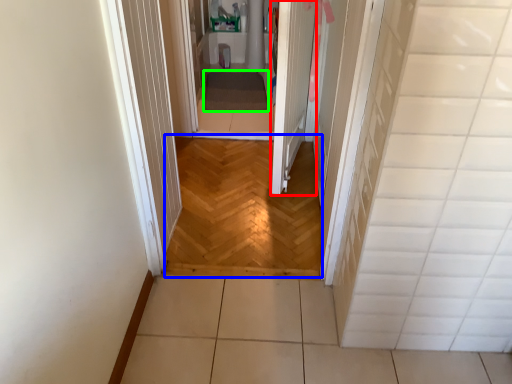
Question: Which is farther away from door (highlighted by a red box)? corridor (highlighted by a blue box) or blanket (highlighted by a green box)?

Choices:
 (A) corridor
 (B) blanket

Answer: (B)